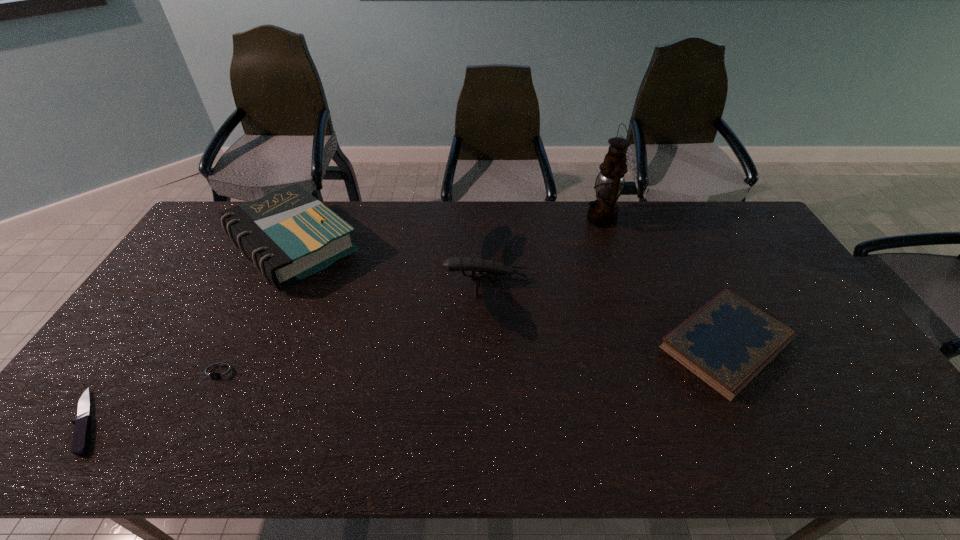
The height and width of the screenshot is (540, 960). In order to click on the tallest object in this screenshot , I will do `click(603, 212)`.

This screenshot has width=960, height=540. I want to click on the fifth shortest object, so click(x=289, y=234).

Image resolution: width=960 pixels, height=540 pixels. Find the location of `the taller paperback book`. the taller paperback book is located at coordinates (289, 234).

Find the location of `drone`. drone is located at coordinates (500, 309).

In order to click on the third object from right to left in this screenshot , I will do click(x=500, y=309).

What are the coordinates of `the third shortest object` in the screenshot? It's located at (726, 343).

Identify the location of the shorter paperback book. (726, 343).

This screenshot has width=960, height=540. I want to click on watch, so click(x=222, y=372).

Locate an element on the screen. This screenshot has height=540, width=960. the shortest object is located at coordinates (82, 430).

Locate an element on the screen. Image resolution: width=960 pixels, height=540 pixels. steak knife is located at coordinates (82, 430).